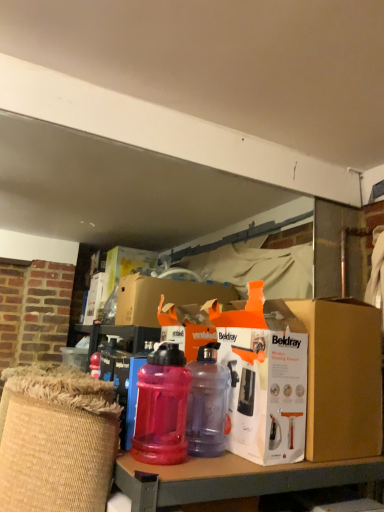
Question: From a real-world perspective, is translucent plastic water bottle at center, placed as the first bottle when sorted from right to left, on top of white cardboard box at center?

Choices:
 (A) no
 (B) yes

Answer: (A)

Question: Does translucent plastic water bottle at center, placed as the first bottle when sorted from right to left, appear on the left side of white cardboard box at center?

Choices:
 (A) no
 (B) yes

Answer: (B)

Question: Is translucent plastic water bottle at center, placed as the first bottle when sorted from right to left, looking in the opposite direction of white cardboard box at center?

Choices:
 (A) no
 (B) yes

Answer: (B)

Question: Is translucent plastic water bottle at center, placed as the first bottle when sorted from right to left, smaller than white cardboard box at center?

Choices:
 (A) yes
 (B) no

Answer: (A)

Question: Is translucent plastic water bottle at center, which is the second bottle from left to right, touching white cardboard box at center?

Choices:
 (A) no
 (B) yes

Answer: (A)

Question: Could you tell me if translucent plastic water bottle at center, placed as the first bottle when sorted from right to left, is facing white cardboard box at center?

Choices:
 (A) yes
 (B) no

Answer: (A)

Question: Is translucent plastic water bottle at center, the second bottle in the right-to-left sequence, facing away from orange cardboard box at center?

Choices:
 (A) no
 (B) yes

Answer: (A)

Question: Is translucent plastic water bottle at center, which is the first bottle from left to right, aimed at orange cardboard box at center?

Choices:
 (A) no
 (B) yes

Answer: (A)

Question: From a real-world perspective, is translucent plastic water bottle at center, the second bottle in the right-to-left sequence, below orange cardboard box at center?

Choices:
 (A) no
 (B) yes

Answer: (B)

Question: Is translucent plastic water bottle at center, which is the first bottle from left to right, positioned far away from orange cardboard box at center?

Choices:
 (A) no
 (B) yes

Answer: (A)

Question: Can you confirm if translucent plastic water bottle at center, which is the first bottle from left to right, is smaller than orange cardboard box at center?

Choices:
 (A) no
 (B) yes

Answer: (B)

Question: From the image's perspective, is translucent plastic water bottle at center, the second bottle in the right-to-left sequence, beneath orange cardboard box at center?

Choices:
 (A) no
 (B) yes

Answer: (B)

Question: Would you consider orange cardboard box at center to be distant from translucent plastic water bottle at center, placed as the first bottle when sorted from right to left?

Choices:
 (A) yes
 (B) no

Answer: (B)